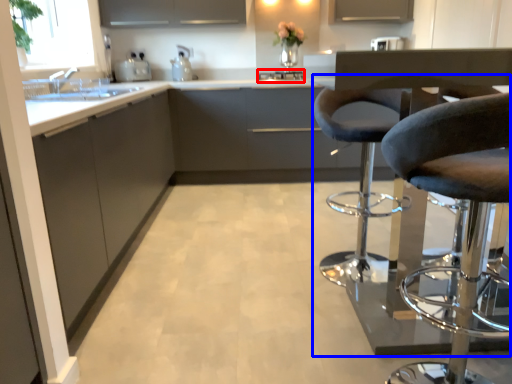
Question: Which object appears closest to the camera in this image, appliance (highlighted by a red box) or chair (highlighted by a blue box)?

Choices:
 (A) appliance
 (B) chair

Answer: (B)